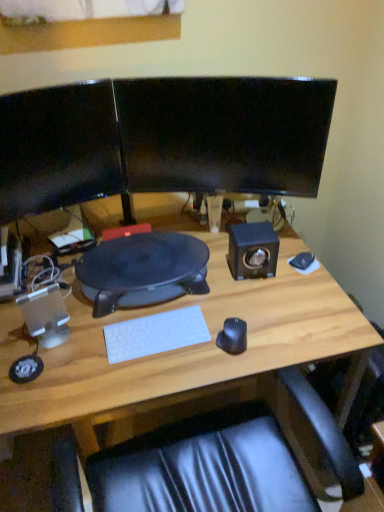
Question: Is black rubberized desk at center not inside black matte mouse at center?

Choices:
 (A) yes
 (B) no

Answer: (A)

Question: Does black rubberized desk at center have a smaller size compared to black matte mouse at center?

Choices:
 (A) yes
 (B) no

Answer: (B)

Question: Is black rubberized desk at center closer to camera compared to black matte mouse at center?

Choices:
 (A) yes
 (B) no

Answer: (B)

Question: Does black rubberized desk at center have a greater width compared to black matte mouse at center?

Choices:
 (A) no
 (B) yes

Answer: (B)

Question: From a real-world perspective, does black rubberized desk at center stand above black matte mouse at center?

Choices:
 (A) no
 (B) yes

Answer: (B)

Question: Does black rubberized desk at center touch black matte mouse at center?

Choices:
 (A) no
 (B) yes

Answer: (A)

Question: From the image's perspective, is matte black speaker at right, the 1th speaker viewed from the back, located beneath wooden desk at center?

Choices:
 (A) no
 (B) yes

Answer: (A)

Question: Is matte black speaker at right, which is the 1th speaker in top-to-bottom order, beside wooden desk at center?

Choices:
 (A) no
 (B) yes

Answer: (A)

Question: Is matte black speaker at right, placed as the 1th speaker when sorted from right to left, positioned beyond the bounds of wooden desk at center?

Choices:
 (A) no
 (B) yes

Answer: (B)

Question: Does matte black speaker at right, placed as the 1th speaker when sorted from right to left, have a greater width compared to wooden desk at center?

Choices:
 (A) no
 (B) yes

Answer: (A)

Question: From the image's perspective, would you say matte black speaker at right, which is the 1th speaker in top-to-bottom order, is positioned over wooden desk at center?

Choices:
 (A) no
 (B) yes

Answer: (B)

Question: Is matte black speaker at right, the 2th speaker in the left-to-right sequence, shorter than wooden desk at center?

Choices:
 (A) no
 (B) yes

Answer: (B)

Question: Is wooden desk at center aimed at white plastic speaker at left, arranged as the 1th speaker when viewed from the front?

Choices:
 (A) no
 (B) yes

Answer: (A)